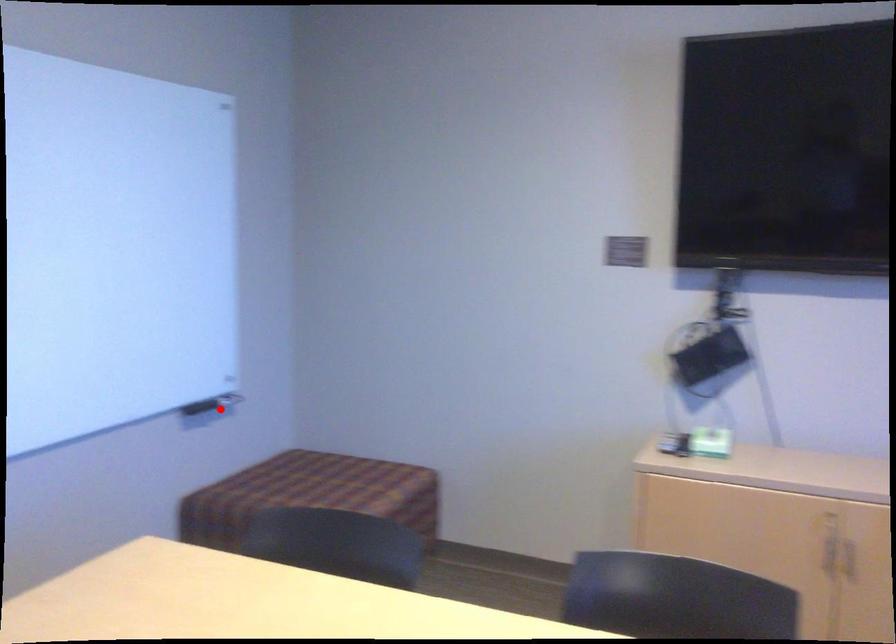
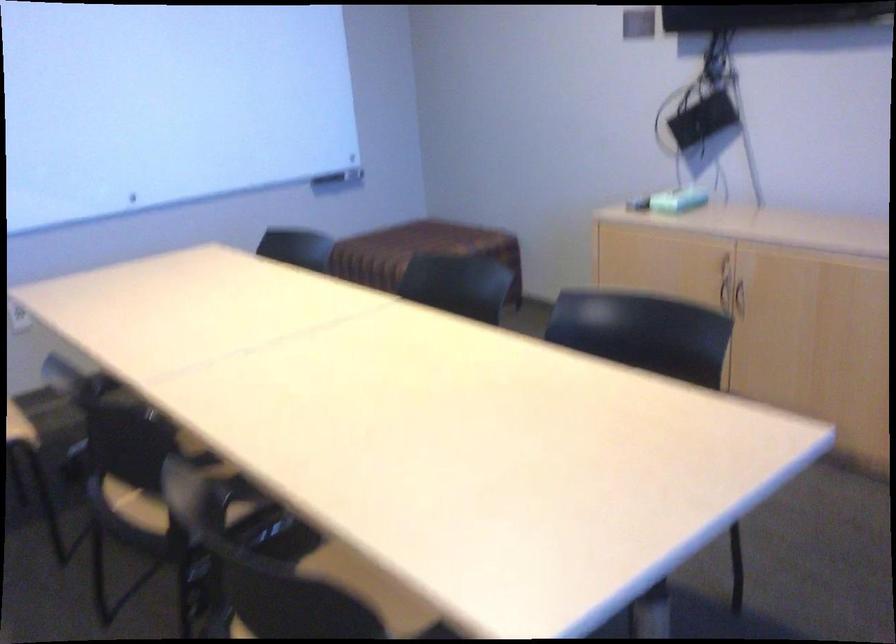
Where in the second image is the point corresponding to the highlighted location from the first image?

(339, 178)